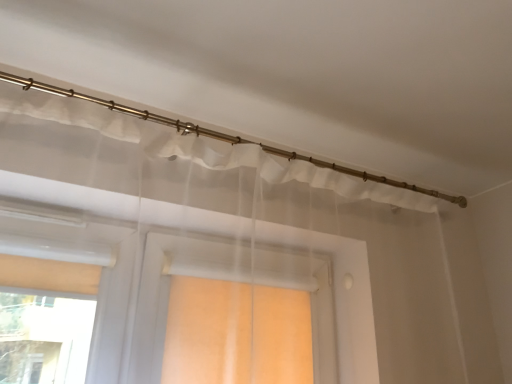
Identify the location of sheer white curtain at upper center. coord(201,148).

What do you see at coordinates (201, 148) in the screenshot?
I see `sheer white curtain at upper center` at bounding box center [201, 148].

Locate an element on the screen. Image resolution: width=512 pixels, height=384 pixels. sheer white curtain at upper center is located at coordinates (201, 148).